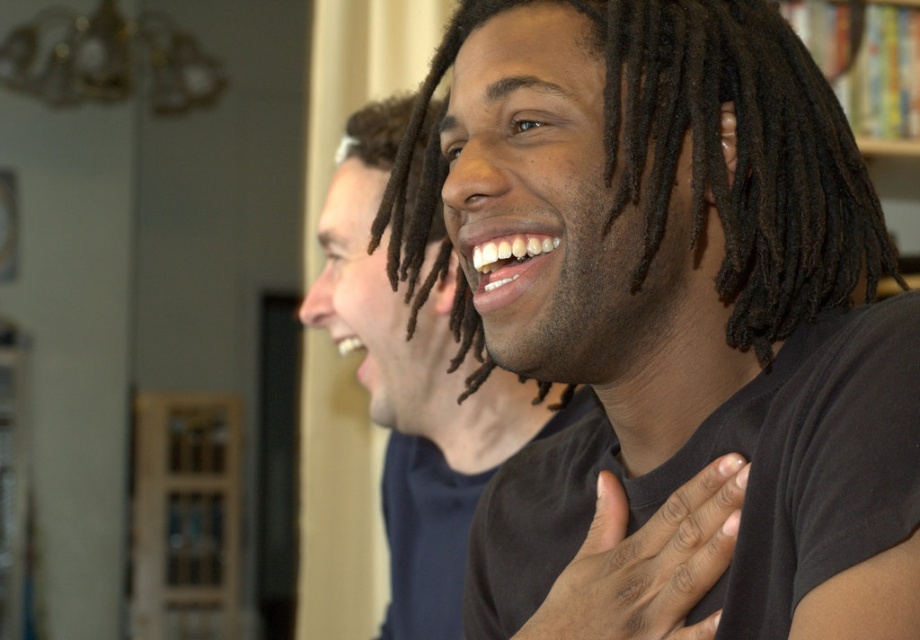
Does black matte t-shirt at center have a greater height compared to black matte hand at center?

Correct, black matte t-shirt at center is much taller as black matte hand at center.

Is black matte t-shirt at center thinner than black matte hand at center?

No.

Describe the element at coordinates (414, 388) in the screenshot. I see `black matte t-shirt at center` at that location.

You are a GUI agent. You are given a task and a screenshot of the screen. Output one action in this format:
    pyautogui.click(x=<x>, y=<y>)
    Task: Click on the black matte t-shirt at center
    This screenshot has width=920, height=640.
    Given the screenshot: What is the action you would take?
    pyautogui.click(x=414, y=388)

Who is shorter, dark brown dreadlocks at center or black matte t-shirt at center?

Standing shorter between the two is dark brown dreadlocks at center.

In the scene shown: Is dark brown dreadlocks at center further to camera compared to black matte t-shirt at center?

No, it is not.

Is point (610, 38) more distant than point (346, 179)?

That is False.

Locate an element on the screen. dark brown dreadlocks at center is located at coordinates (739, 156).

Is dark brown dreadlocks at center wider than black matte hand at center?

Correct, the width of dark brown dreadlocks at center exceeds that of black matte hand at center.

Who is more distant from viewer, (693, 182) or (714, 632)?

The point (693, 182) is behind.

Between point (815, 112) and point (683, 588), which one is positioned in front?

Point (683, 588)

At what (x,y) coordinates should I click in order to perform the action: click on dark brown dreadlocks at center. Please return your answer as a coordinate pair (x, y). The height and width of the screenshot is (640, 920). Looking at the image, I should click on (739, 156).